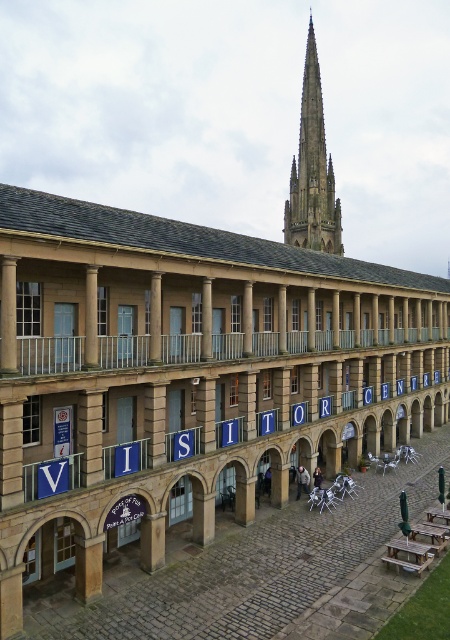
Based on the photo, does silver metallic railing at center have a lesser width compared to dark gray stone spire at upper center?

In fact, silver metallic railing at center might be wider than dark gray stone spire at upper center.

What do you see at coordinates (49, 355) in the screenshot? This screenshot has width=450, height=640. I see `silver metallic railing at center` at bounding box center [49, 355].

Locate an element on the screen. silver metallic railing at center is located at coordinates (49, 355).

Is silver metallic railing at center taller than wooden picnic table at lower right?

Indeed, silver metallic railing at center has a greater height compared to wooden picnic table at lower right.

Is silver metallic railing at center positioned in front of wooden picnic table at lower right?

Yes, it is.

Does point (139, 339) lie in front of point (426, 556)?

No, (139, 339) is behind (426, 556).

This screenshot has height=640, width=450. What are the coordinates of `silver metallic railing at center` in the screenshot? It's located at (49, 355).

Can you confirm if dark gray stone spire at upper center is bigger than wooden picnic table at lower right?

Yes, dark gray stone spire at upper center is bigger than wooden picnic table at lower right.

Which of these two, dark gray stone spire at upper center or wooden picnic table at lower right, stands shorter?

Standing shorter between the two is wooden picnic table at lower right.

Does point (286, 220) come closer to viewer compared to point (418, 573)?

No, it is behind (418, 573).

The height and width of the screenshot is (640, 450). I want to click on dark gray stone spire at upper center, so click(x=313, y=172).